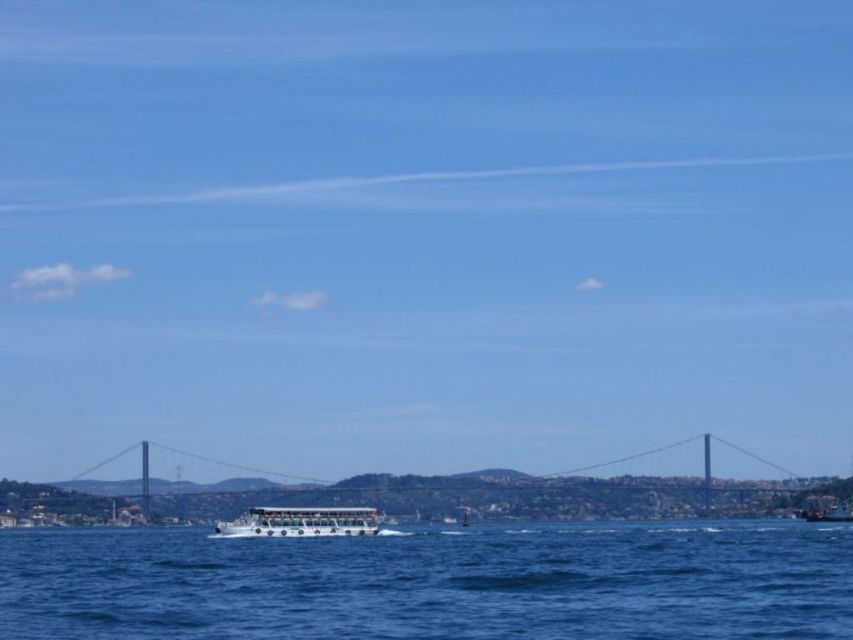
Question: Can you confirm if metallic gray bridge at center is bigger than white glossy boat at center?

Choices:
 (A) no
 (B) yes

Answer: (B)

Question: Is white glossy boat at center smaller than white plastic boat at lower right?

Choices:
 (A) no
 (B) yes

Answer: (A)

Question: Which of the following is the closest to the observer?

Choices:
 (A) (718, 506)
 (B) (805, 506)
 (C) (807, 544)

Answer: (C)

Question: Considering the relative positions of blue water at center and metallic gray bridge at center in the image provided, where is blue water at center located with respect to metallic gray bridge at center?

Choices:
 (A) right
 (B) left

Answer: (B)

Question: Which of the following is the farthest from the observer?

Choices:
 (A) (757, 486)
 (B) (628, 572)
 (C) (363, 531)

Answer: (A)

Question: Which point is farther to the camera?

Choices:
 (A) (469, 548)
 (B) (827, 512)
 (C) (190, 483)

Answer: (C)